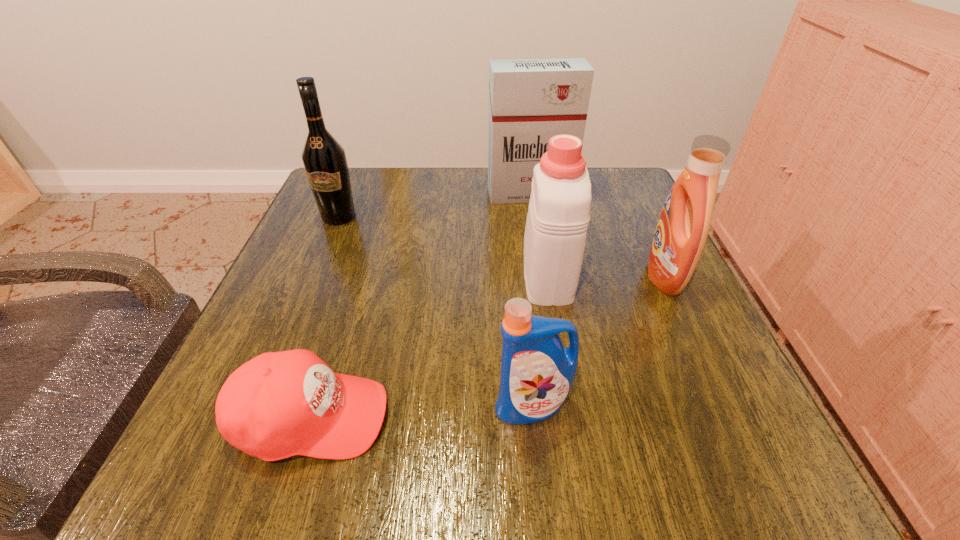
Identify the location of wine bottle. The image size is (960, 540). (324, 159).

Locate an element on the screen. This screenshot has width=960, height=540. the farthest object is located at coordinates (530, 100).

Image resolution: width=960 pixels, height=540 pixels. Identify the location of the rightmost detergent. (680, 236).

Where is `the shortest detergent`? Image resolution: width=960 pixels, height=540 pixels. the shortest detergent is located at coordinates (537, 373).

I want to click on the nearest detergent, so click(x=537, y=373).

The height and width of the screenshot is (540, 960). What are the coordinates of `the shortest object` in the screenshot? It's located at click(279, 404).

Find the location of a particular element. This screenshot has width=960, height=540. free space located 0.260m on the label of the wine bottle is located at coordinates (299, 314).

Where is `vacant area situated 0.140m on the left of the cigarette case`? This screenshot has height=540, width=960. vacant area situated 0.140m on the left of the cigarette case is located at coordinates (430, 194).

Locate an element on the screen. vacant space located 0.330m on the front-facing side of the rightmost object is located at coordinates (478, 276).

Image resolution: width=960 pixels, height=540 pixels. In order to click on free region located on the front-facing side of the rightmost object in this screenshot , I will do `click(524, 276)`.